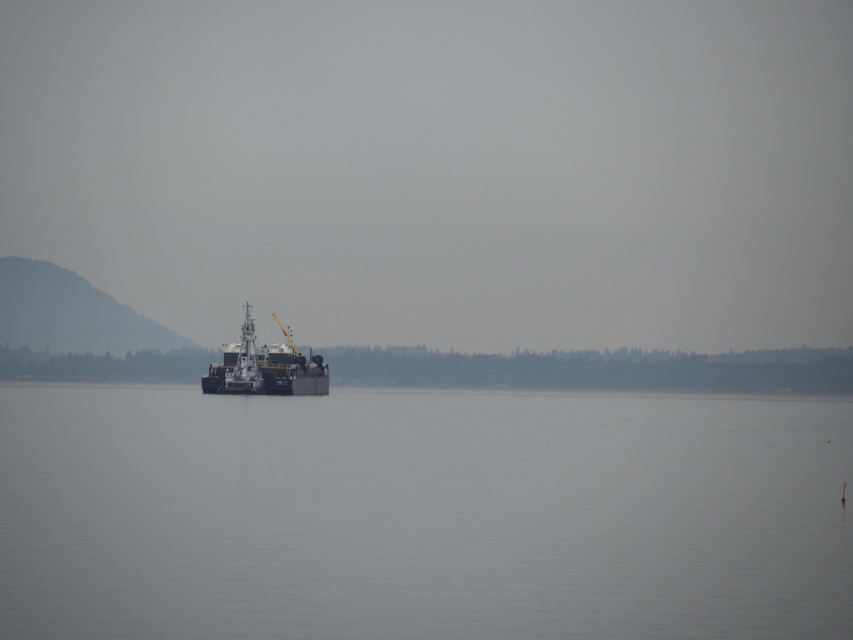
You are a sailor on a boat and you want to know if the gray water at center is higher or lower than the metallic gray barge at center. Based on the scene description, what can you determine?

The gray water at center has a lesser height compared to the metallic gray barge at center, so the gray water at center is lower than the metallic gray barge at center.

You are a marine biologist studying water surface areas. You observe the gray water at center and the metallic gray barge at center in the image. Which object has a greater width?

The gray water at center has a greater width than the metallic gray barge at center, as stated in the description.

You are standing at point A with coordinates point A at (490, 584). You want to reach point B at 0.825, 0.487. The distance between them is 108.09 feet. You have a drone that can fly 100 feet. Can your drone reach point B from point A?

The distance between point A at (490, 584) and point B at 0.825, 0.487 is 108.09 feet. Since the drone can only fly 100 feet, it cannot reach point B from point A.